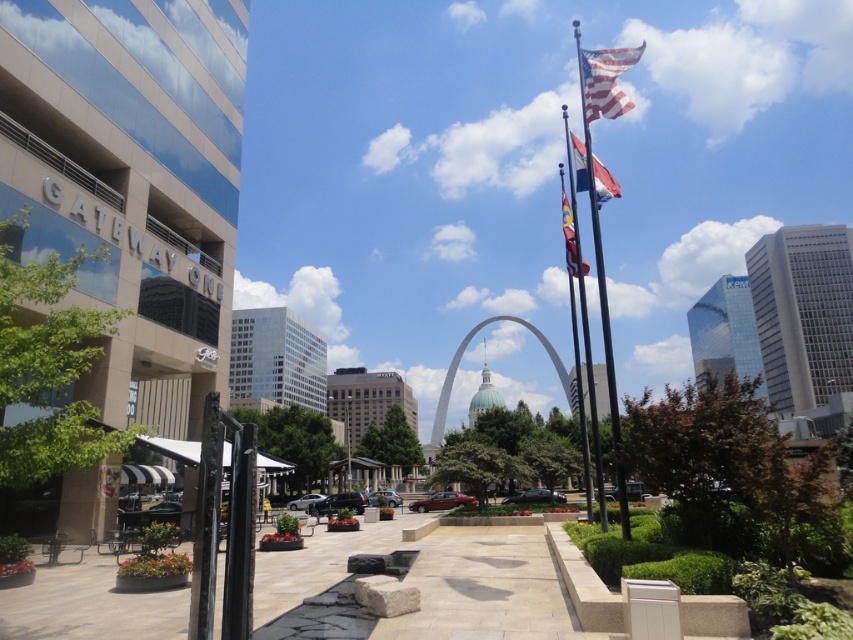
You are a visitor at the St. Louis Gateway Arch plaza. You notice a metallic flag pole at upper right and a silky blue flag at upper center. Which object is taller?

The metallic flag pole at upper right is taller than the silky blue flag at upper center.

You are standing in the plaza near the Gateway Arch and want to reach the point marked at coordinates point (596,260). If you can walk 1.5 meters per second, how many seconds will it take you to reach that point?

The distance between you and the point (596,260) is 10.74 meters. At a walking speed of 1.5 meters per second, it will take approximately 7.16 seconds to reach the point.

You are an architect planning to install a new decorative element between the metallic flag pole at upper right and the silky blue flag at upper center. Considering their widths, which object should you place closer to the narrower one to maintain visual balance?

You should place the new decorative element closer to the silky blue flag at upper center since it is narrower than the metallic flag pole at upper right, helping to balance the visual weight.